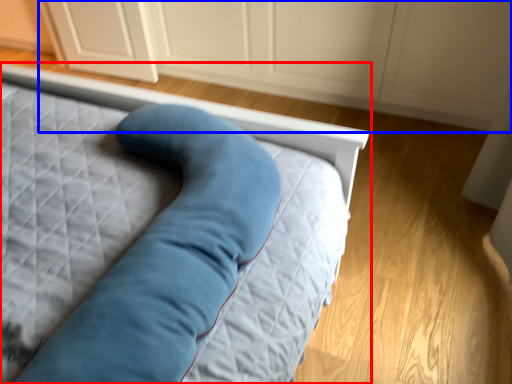
Question: Which object is closer to the camera taking this photo, bed (highlighted by a red box) or dresser (highlighted by a blue box)?

Choices:
 (A) bed
 (B) dresser

Answer: (A)